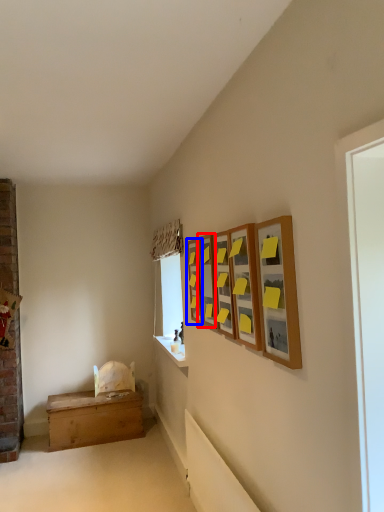
Question: Which object is closer to the camera taking this photo, picture frame (highlighted by a red box) or picture frame (highlighted by a blue box)?

Choices:
 (A) picture frame
 (B) picture frame

Answer: (A)